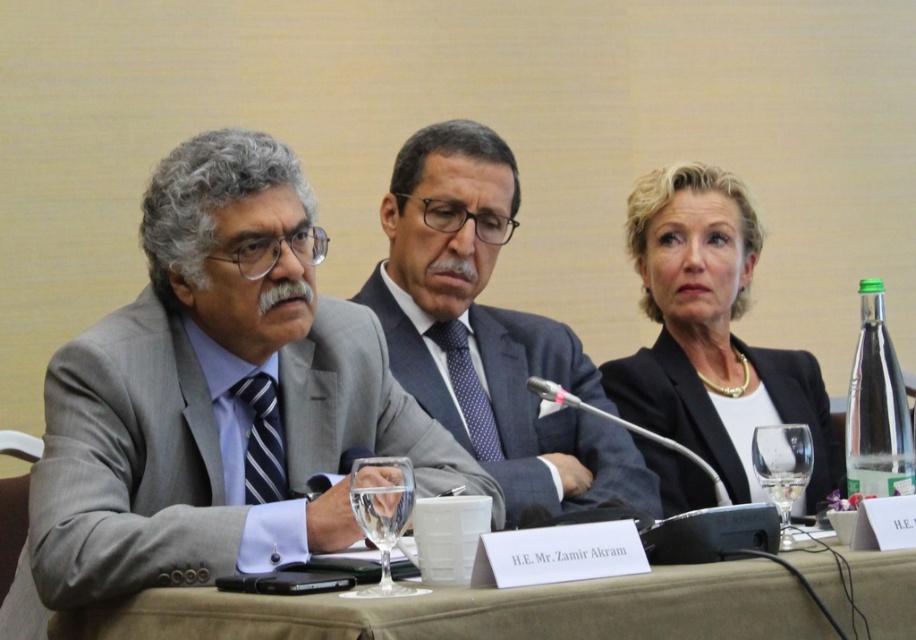
What are the coordinates of the brown fabric table at center in the image?

The brown fabric table at center is located at coordinates point (483, 611).

You are a server at a formal event and need to place a new wine glass on the table. The brown fabric table at center is currently occupied by a clear glass wine glass at center. Where should you place the new glass to ensure it is closer to the viewer than the existing one?

The brown fabric table at center is closer to the viewer than the clear glass wine glass at center. To place the new glass closer to the viewer, position it on the brown fabric table at center, which is already nearer to the viewer compared to the existing glass.